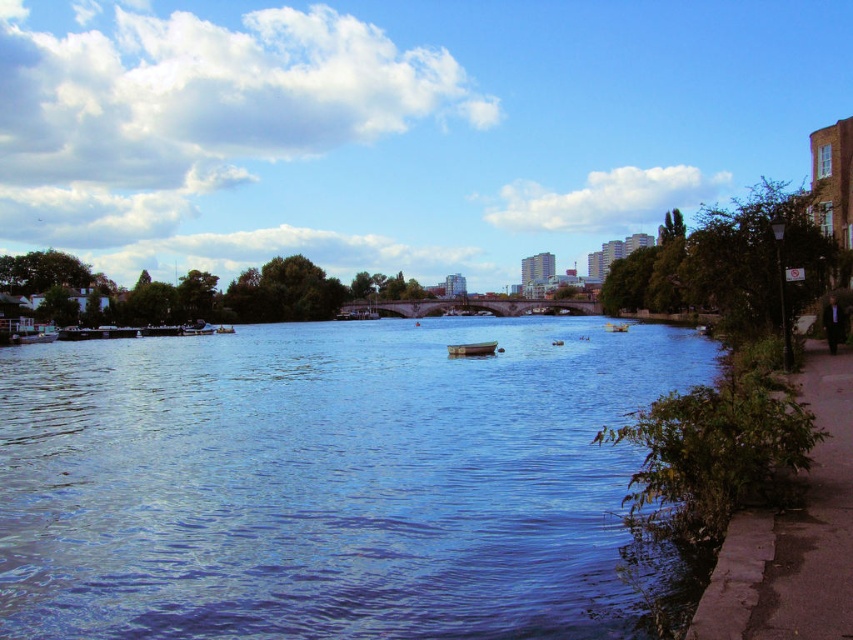
Question: Considering the relative positions of blue water at center and yellow plastic boat at center in the image provided, where is blue water at center located with respect to yellow plastic boat at center?

Choices:
 (A) left
 (B) right

Answer: (A)

Question: Which is nearer to the blue water at center?

Choices:
 (A) yellow plastic boat at center
 (B) wooden boat at center

Answer: (B)

Question: Is blue water at center closer to the viewer compared to yellow plastic boat at center?

Choices:
 (A) no
 (B) yes

Answer: (B)

Question: Can you confirm if wooden boat at center is positioned below yellow plastic boat at center?

Choices:
 (A) no
 (B) yes

Answer: (B)

Question: Which of the following is the farthest from the observer?

Choices:
 (A) (610, 328)
 (B) (15, 515)
 (C) (465, 352)

Answer: (A)

Question: Based on their relative distances, which object is nearer to the wooden boat at center?

Choices:
 (A) yellow plastic boat at center
 (B) blue water at center

Answer: (B)